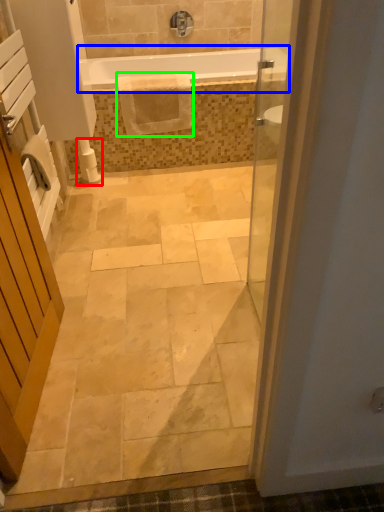
Question: Which object is the closest to the toilet paper (highlighted by a red box)? Choose among these: bathtub (highlighted by a blue box) or material (highlighted by a green box).

Choices:
 (A) bathtub
 (B) material

Answer: (B)